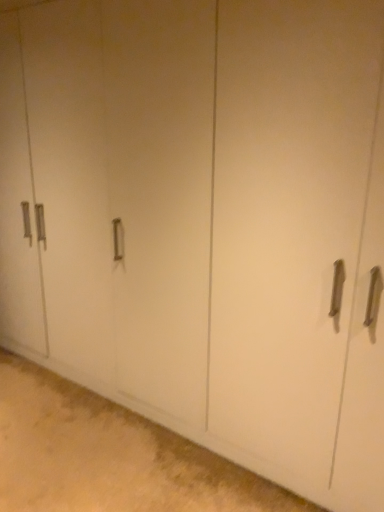
What is the approximate width of white matte cabinet at lower center?

The width of white matte cabinet at lower center is 3.78 feet.

You are a GUI agent. You are given a task and a screenshot of the screen. Output one action in this format:
    pyautogui.click(x=<x>, y=<y>)
    Task: Click on the white matte cabinet at lower center
    
    Given the screenshot: What is the action you would take?
    pyautogui.click(x=109, y=456)

What do you see at coordinates (109, 456) in the screenshot?
I see `white matte cabinet at lower center` at bounding box center [109, 456].

The image size is (384, 512). I want to click on white matte cabinet at lower center, so [109, 456].